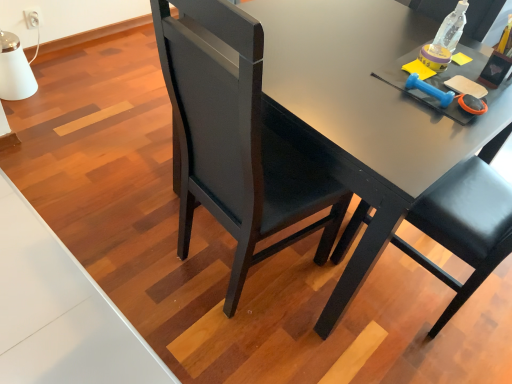
What do you see at coordinates (362, 119) in the screenshot? I see `matte black desk at center` at bounding box center [362, 119].

Locate an element on the screen. The height and width of the screenshot is (384, 512). matte black desk at center is located at coordinates (362, 119).

From the image's perspective, does clear plastic bottle at upper right appear lower than black leather chair at center?

Actually, clear plastic bottle at upper right appears above black leather chair at center in the image.

Is point (446, 20) more distant than point (298, 177)?

Yes, it is behind point (298, 177).

This screenshot has width=512, height=384. There is a black leather chair at center. Find the location of `bottle above it (from a real-world perspective)`. bottle above it (from a real-world perspective) is located at coordinates (451, 28).

From a real-world perspective, relative to black leather chair at center, is clear plastic bottle at upper right vertically above or below?

clear plastic bottle at upper right is above black leather chair at center.

Consider the image. Which of these two, matte black desk at center or black leather chair at center, is thinner?

Thinner between the two is black leather chair at center.

Which is less distant, (343, 177) or (230, 82)?

Point (343, 177) is positioned farther from the camera compared to point (230, 82).

Is matte black desk at center behind black leather chair at center?

Yes, the depth of matte black desk at center is greater than that of black leather chair at center.

Locate an element on the screen. The height and width of the screenshot is (384, 512). desk above the black leather chair at center (from the image's perspective) is located at coordinates (362, 119).

Which object is closer to the camera taking this photo, black leather chair at center or matte black desk at center?

Positioned in front is black leather chair at center.

Is point (218, 12) in front of point (425, 20)?

Yes.

Locate an element on the screen. This screenshot has height=384, width=512. bottle lying above the matte black desk at center (from the image's perspective) is located at coordinates (451, 28).

From the image's perspective, is clear plastic bottle at upper right above or below matte black desk at center?

From the image's perspective, clear plastic bottle at upper right appears above matte black desk at center.

Is there a large distance between clear plastic bottle at upper right and matte black desk at center?

clear plastic bottle at upper right is near matte black desk at center, not far away.

Can you confirm if black leather chair at center is smaller than clear plastic bottle at upper right?

Actually, black leather chair at center might be larger than clear plastic bottle at upper right.

Considering the sizes of black leather chair at center and clear plastic bottle at upper right in the image, is black leather chair at center wider or thinner than clear plastic bottle at upper right?

Clearly, black leather chair at center has more width compared to clear plastic bottle at upper right.

Which is closer to the camera, [226,207] or [462,12]?

Clearly, point [226,207] is closer to the camera than point [462,12].

Identify the location of chair in front of the clear plastic bottle at upper right. (234, 139).

Between matte black desk at center and clear plastic bottle at upper right, which one has larger size?

matte black desk at center.

Which is in front, matte black desk at center or clear plastic bottle at upper right?

Positioned in front is matte black desk at center.

Between matte black desk at center and clear plastic bottle at upper right, which one has larger width?

Wider between the two is matte black desk at center.

How far apart are matte black desk at center and clear plastic bottle at upper right?

matte black desk at center and clear plastic bottle at upper right are 15.37 inches apart from each other.

Locate an element on the screen. The height and width of the screenshot is (384, 512). chair lying below the clear plastic bottle at upper right (from the image's perspective) is located at coordinates (234, 139).

This screenshot has width=512, height=384. I want to click on desk above the black leather chair at center (from the image's perspective), so click(x=362, y=119).

From the image, which object appears to be farther from black leather chair at center, clear plastic bottle at upper right or matte black desk at center?

Based on the image, clear plastic bottle at upper right appears to be further to black leather chair at center.

From the picture: Based on their spatial positions, is matte black desk at center or clear plastic bottle at upper right closer to black leather chair at center?

matte black desk at center is closer to black leather chair at center.

Estimate the real-world distances between objects in this image. Which object is closer to matte black desk at center, clear plastic bottle at upper right or black leather chair at center?

Based on the image, black leather chair at center appears to be nearer to matte black desk at center.

Which object lies further to the anchor point matte black desk at center, black leather chair at center or clear plastic bottle at upper right?

clear plastic bottle at upper right is positioned further to the anchor matte black desk at center.

Based on their spatial positions, is black leather chair at center or matte black desk at center closer to clear plastic bottle at upper right?

Based on the image, matte black desk at center appears to be nearer to clear plastic bottle at upper right.

From the image, which object appears to be farther from clear plastic bottle at upper right, matte black desk at center or black leather chair at center?

The object further to clear plastic bottle at upper right is black leather chair at center.

This screenshot has height=384, width=512. What are the coordinates of `desk positioned between black leather chair at center and clear plastic bottle at upper right from near to far` in the screenshot? It's located at (362, 119).